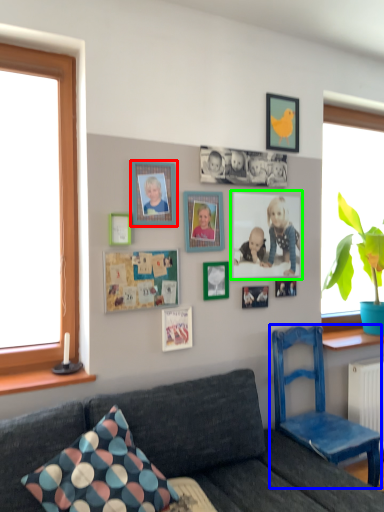
Question: Which is farther away from picture frame (highlighted by a red box)? chair (highlighted by a blue box) or picture frame (highlighted by a green box)?

Choices:
 (A) chair
 (B) picture frame

Answer: (A)